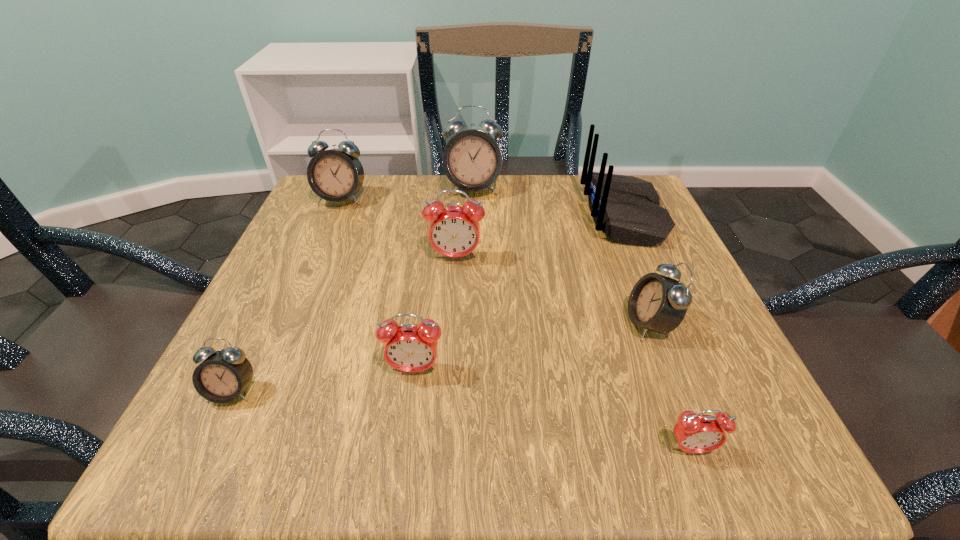
Locate an element on the screen. Image resolution: width=960 pixels, height=540 pixels. blank region between the third smallest white alarm clock and the smallest white alarm clock is located at coordinates (287, 295).

Identify which object is the nearest to the second smallest red alarm clock. Please provide its 2D coordinates. Your answer should be formatted as a tuple, i.e. [(x, y)], where the tuple contains the x and y coordinates of a point satisfying the conditions above.

[(224, 374)]

This screenshot has width=960, height=540. I want to click on object that is the second closest to the second white alarm clock from right to left, so click(627, 207).

The width and height of the screenshot is (960, 540). Identify the location of alarm clock that is the second closest to the black router. (472, 160).

This screenshot has width=960, height=540. Find the location of `alarm clock that is the fifth nearest to the second biggest white alarm clock`. alarm clock that is the fifth nearest to the second biggest white alarm clock is located at coordinates coord(657,303).

At what (x,y) coordinates should I click in order to perform the action: click on the closest white alarm clock relative to the third smallest white alarm clock. Please return your answer as a coordinate pair (x, y). Looking at the image, I should click on (472, 160).

This screenshot has width=960, height=540. I want to click on the closest white alarm clock to the black router, so click(x=657, y=303).

Where is `red alarm clock object that ranks as the second closest to the third smallest white alarm clock`? This screenshot has height=540, width=960. red alarm clock object that ranks as the second closest to the third smallest white alarm clock is located at coordinates (408, 347).

Point out which red alarm clock is positioned as the second nearest to the black router. Please provide its 2D coordinates. Your answer should be formatted as a tuple, i.e. [(x, y)], where the tuple contains the x and y coordinates of a point satisfying the conditions above.

[(408, 347)]

You are a GUI agent. You are given a task and a screenshot of the screen. Output one action in this format:
    pyautogui.click(x=<x>, y=<y>)
    Task: Click on the free space in the image that satisfies the following two spatial constraints: 1. on the face of the second smallest white alarm clock; 2. on the face of the second nearest red alarm clock
    This screenshot has height=540, width=960.
    Given the screenshot: What is the action you would take?
    pyautogui.click(x=666, y=369)